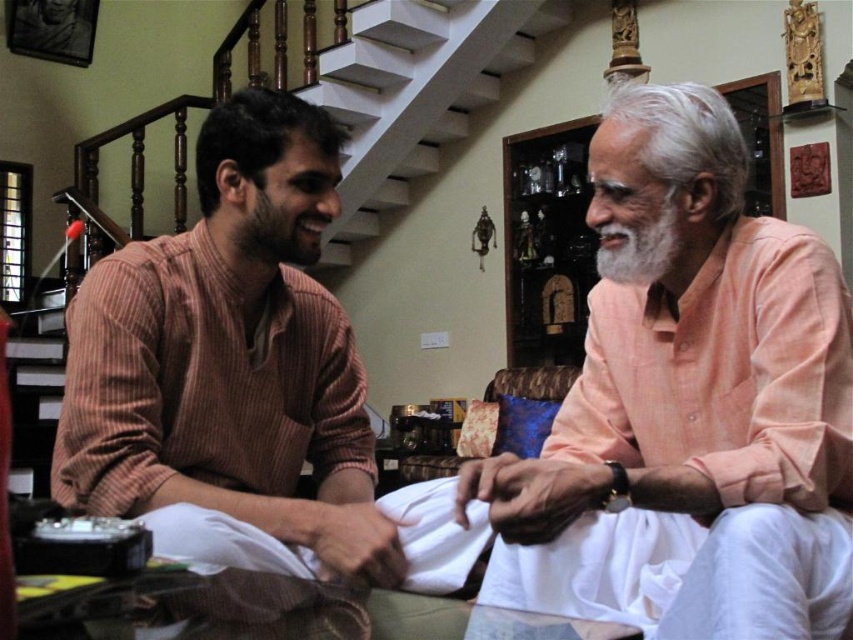
Question: Which object is the closest to the brown matte beard at upper left?

Choices:
 (A) white soft beard at center
 (B) white wooden stairs at upper center
 (C) light peach cotton shirt at center
 (D) brown striped shirt at left

Answer: (D)

Question: Which object is farther from the camera taking this photo?

Choices:
 (A) light peach cotton shirt at center
 (B) white wooden stairs at upper center

Answer: (B)

Question: Observing the image, what is the correct spatial positioning of brown striped shirt at left in reference to brown matte beard at upper left?

Choices:
 (A) below
 (B) above

Answer: (A)

Question: Where is brown matte beard at upper left located in relation to white soft beard at center in the image?

Choices:
 (A) right
 (B) left

Answer: (B)

Question: Does brown striped shirt at left appear over white wooden stairs at upper center?

Choices:
 (A) no
 (B) yes

Answer: (A)

Question: Among these objects, which one is farthest from the camera?

Choices:
 (A) white wooden stairs at upper center
 (B) brown striped shirt at left

Answer: (A)